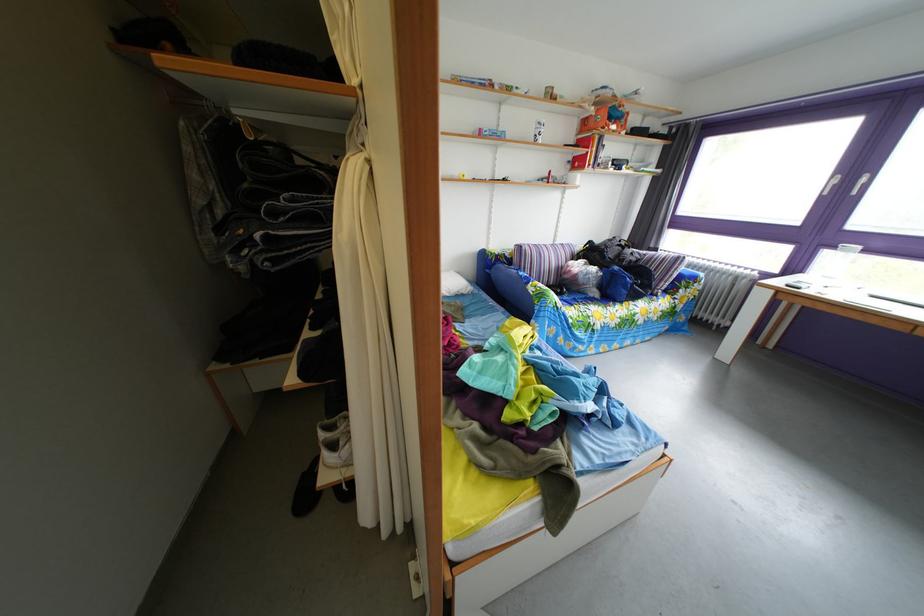
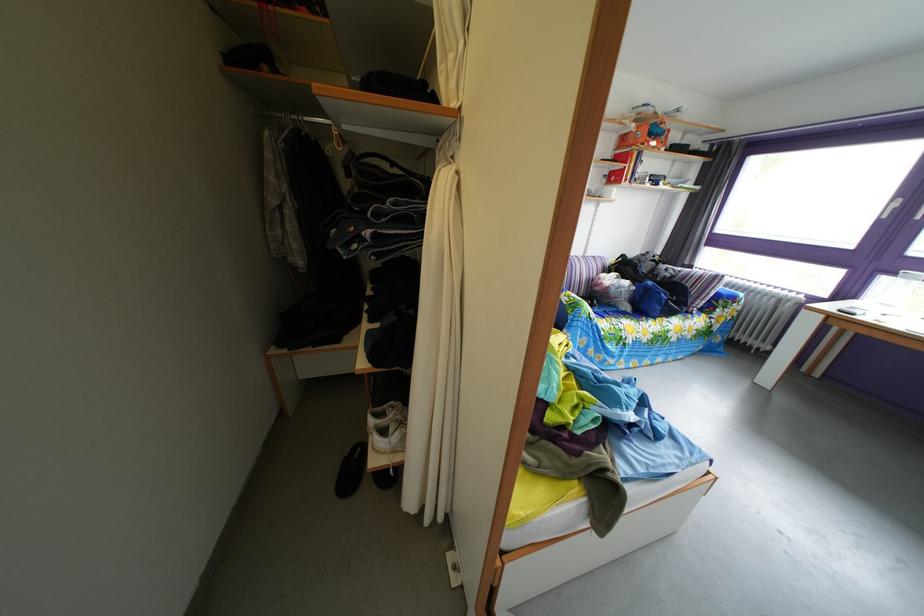
The point at (x=333, y=444) is marked in the first image. Where is the corresponding point in the second image?

(383, 430)